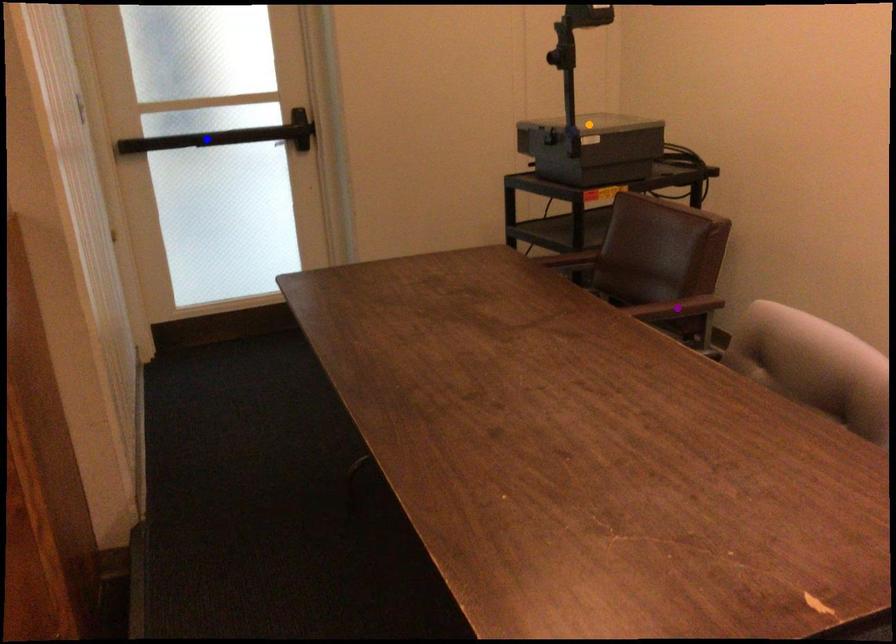
Order these from nearest to farthest:
orange point | purple point | blue point

orange point → blue point → purple point